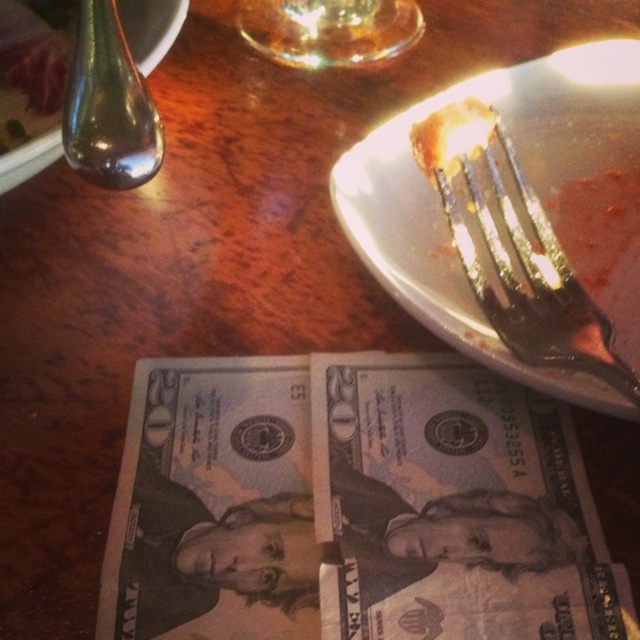
Who is positioned more to the right, transparent glass at upper center or metallic spoon at upper left?

transparent glass at upper center

Identify the location of transparent glass at upper center. Image resolution: width=640 pixels, height=640 pixels. (330, 29).

This screenshot has height=640, width=640. In order to click on metallic silver fork at upper right in this screenshot , I will do `click(525, 172)`.

Which is below, metallic silver fork at upper right or transparent glass at upper center?

metallic silver fork at upper right is lower down.

Is point (396, 120) less distant than point (380, 6)?

Yes, point (396, 120) is closer to viewer.

You are a GUI agent. You are given a task and a screenshot of the screen. Output one action in this format:
    pyautogui.click(x=<x>, y=<y>)
    Task: Click on the metallic silver fork at upper right
    The height and width of the screenshot is (640, 640).
    Given the screenshot: What is the action you would take?
    pyautogui.click(x=525, y=172)